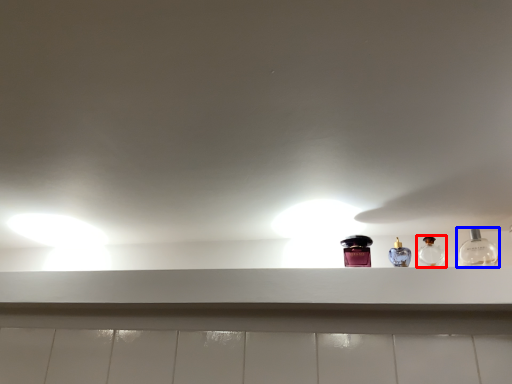
Question: Which object appears closest to the camera in this image, bottle (highlighted by a red box) or bottle (highlighted by a blue box)?

Choices:
 (A) bottle
 (B) bottle

Answer: (B)